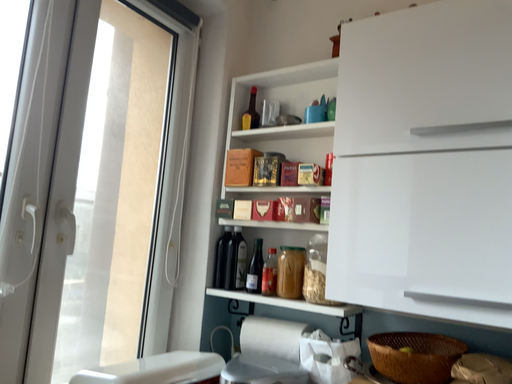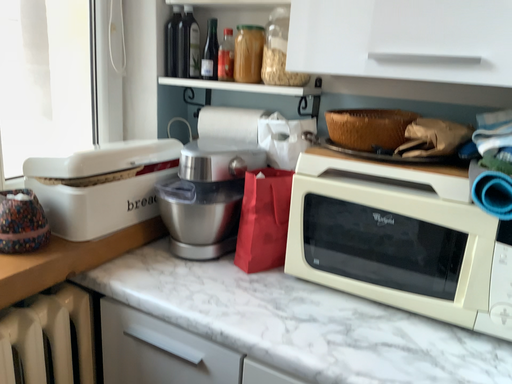
Question: Which way did the camera rotate in the video?

Choices:
 (A) rotated downward
 (B) rotated upward

Answer: (A)